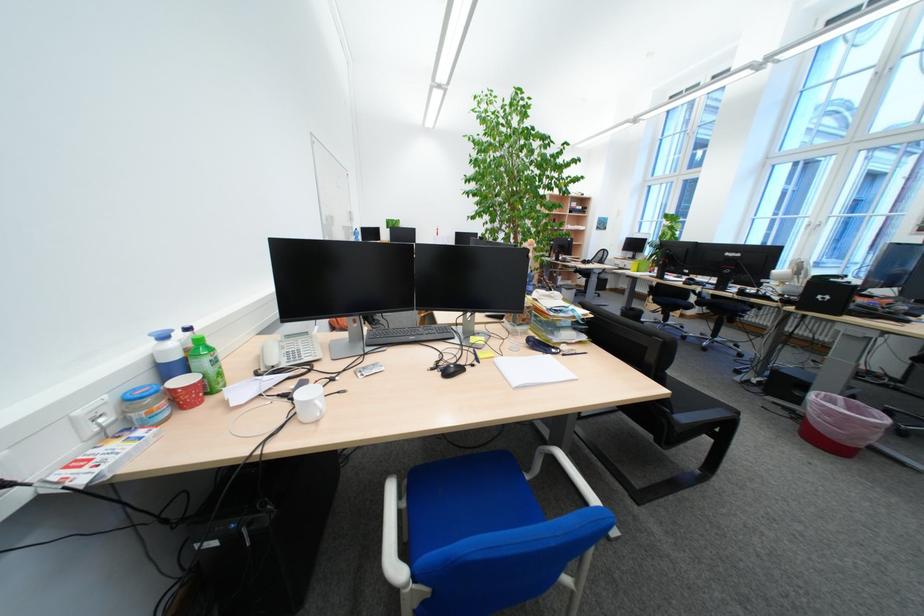
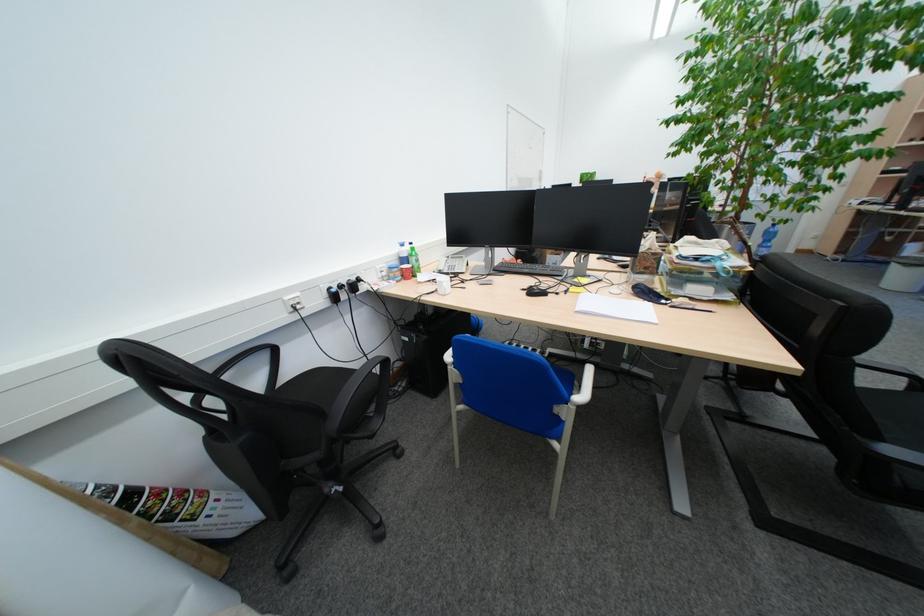
In the second image, find the point that corresponds to (x=302, y=418) in the first image.

(447, 292)